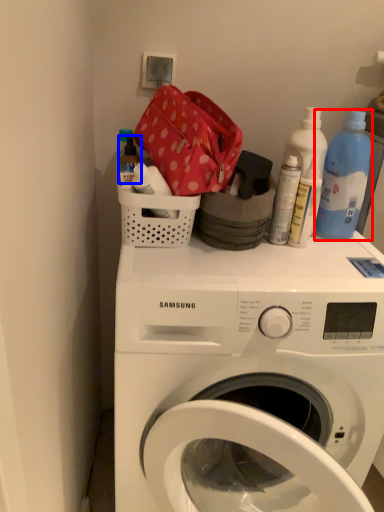
Question: Which of the following is the farthest to the observer, cleaning product (highlighted by a red box) or bottle (highlighted by a blue box)?

Choices:
 (A) cleaning product
 (B) bottle

Answer: (B)